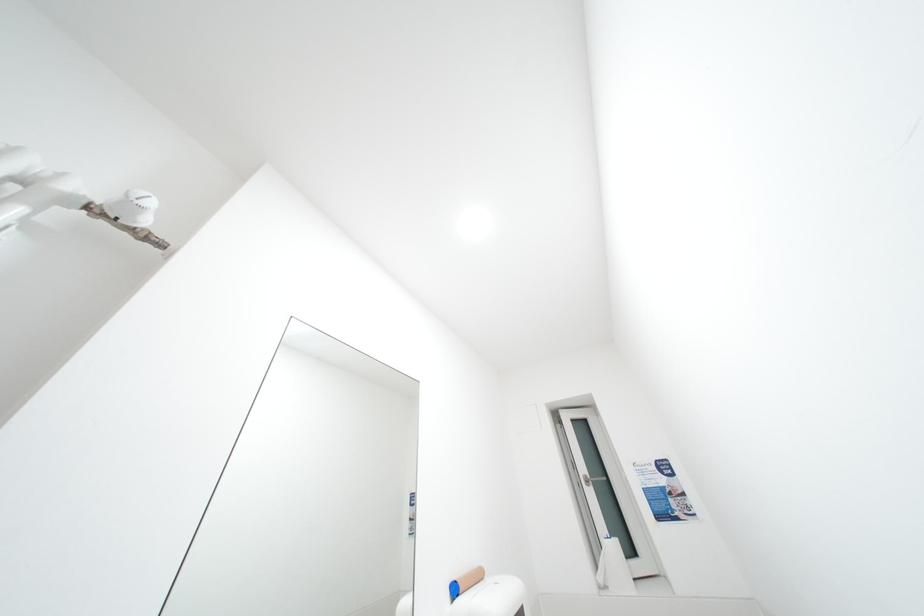
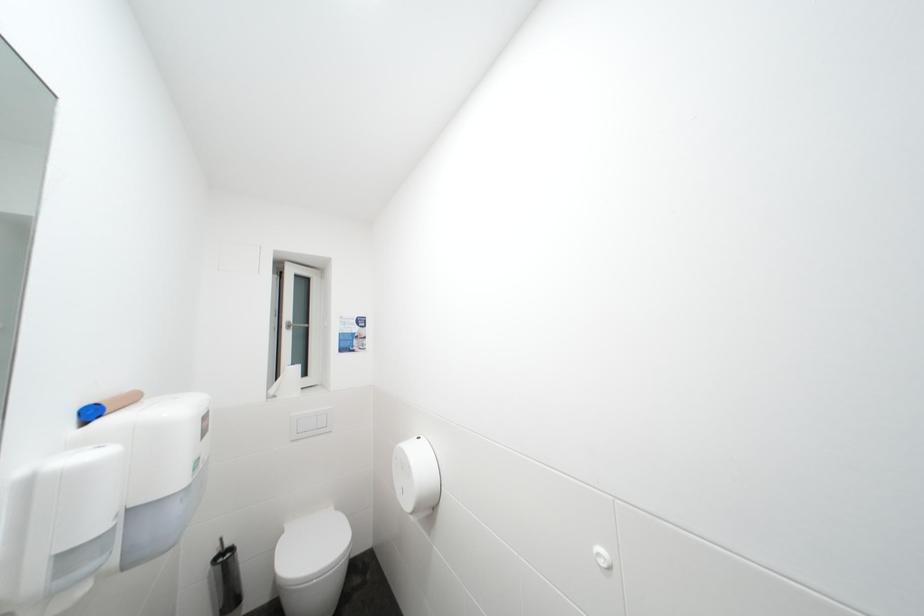
Question: The camera is either moving clockwise (left) or counter-clockwise (right) around the object. The first image is from the beginning of the video and the second image is from the end. Is the camera moving left or right when shooting the video?

Choices:
 (A) Left
 (B) Right

Answer: (A)